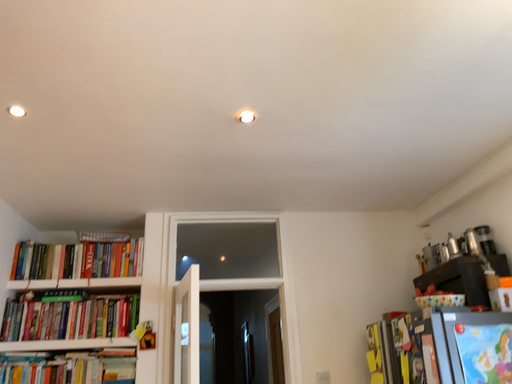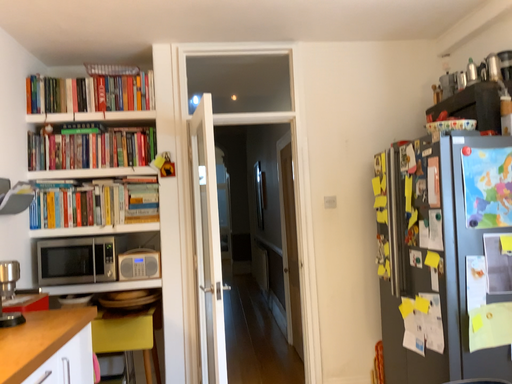
Question: Which way did the camera rotate in the video?

Choices:
 (A) rotated downward
 (B) rotated upward

Answer: (A)